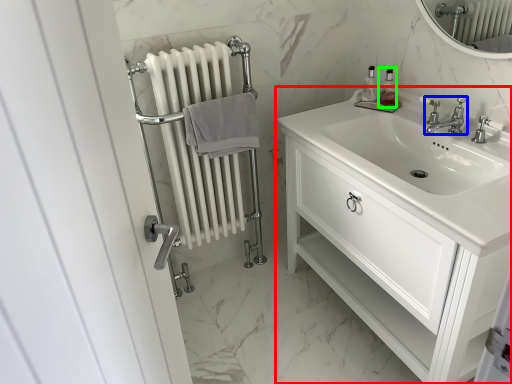
Question: Which object is positioned farthest from bathroom cabinet (highlighted by a red box)? Select from tap (highlighted by a blue box) and soap dispenser (highlighted by a green box).

Choices:
 (A) tap
 (B) soap dispenser

Answer: (B)